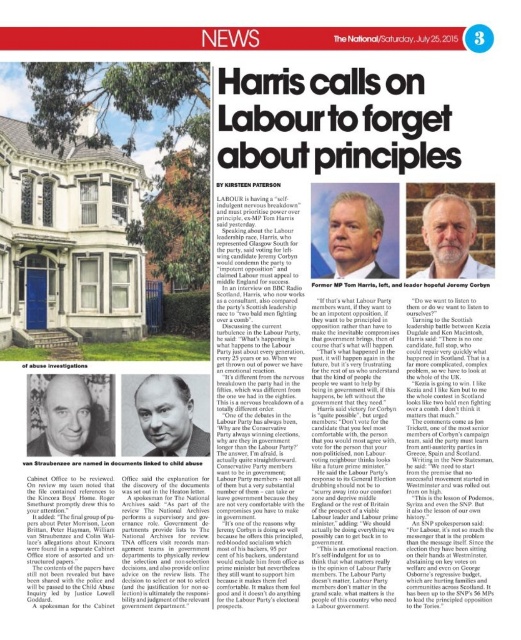
Based on the image provided, where is the gray beard at upper center located in terms of coordinates?

The gray beard at upper center is located at coordinates point [451,240].

Based on the scene described, if the matte black portrait at center and the gray hair man at center are both in the news article, which object is positioned to the right side?

The gray hair man at center is positioned to the right of the matte black portrait at center.

You are a delivery person who needs to place a 3.5 meter long package between the matte black portrait at center and the gray beard at upper center. Can you fit it there?

The distance between the matte black portrait at center and the gray beard at upper center is 5.80 meters, so the 3.5 meter long package can fit between them.